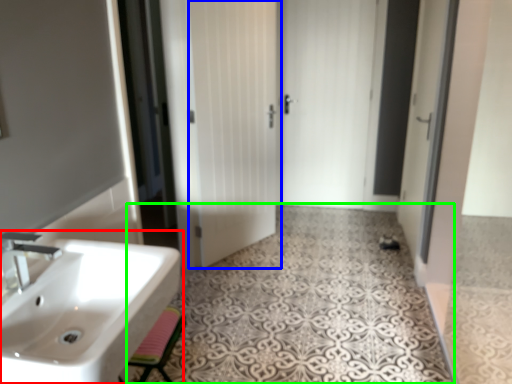
Question: Considering the real-world distances, which object is farthest from sink (highlighted by a red box)? door (highlighted by a blue box) or pattern (highlighted by a green box)?

Choices:
 (A) door
 (B) pattern

Answer: (A)